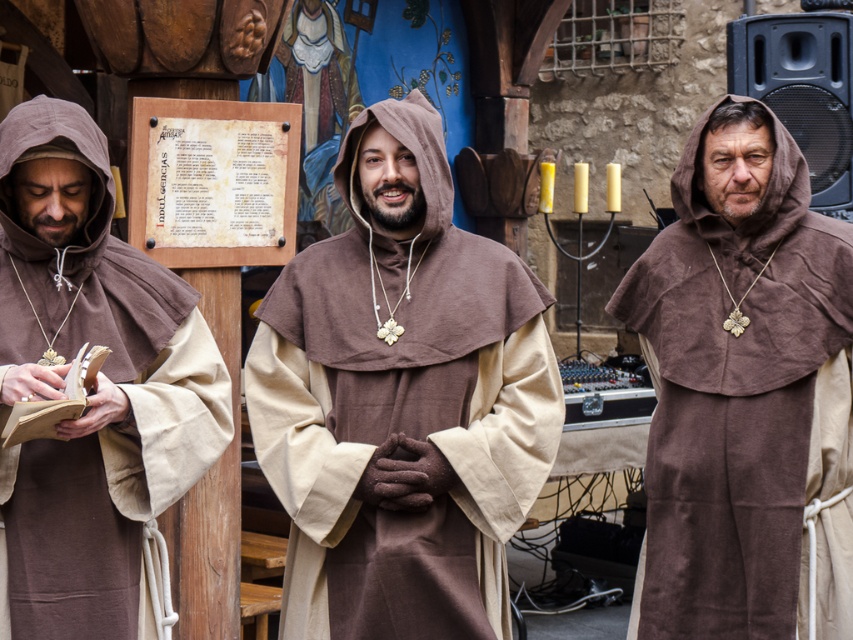
The height and width of the screenshot is (640, 853). Identify the location of brown cotton robe at center. (401, 401).

Is brown cotton robe at center shorter than brown cotton robe at left?

Incorrect, brown cotton robe at center's height does not fall short of brown cotton robe at left's.

I want to click on brown cotton robe at center, so click(x=401, y=401).

Does brown linen robe at right have a smaller size compared to brown cotton robe at left?

Actually, brown linen robe at right might be larger than brown cotton robe at left.

Which is above, brown linen robe at right or brown cotton robe at left?

brown cotton robe at left is above.

Does point (740, 573) come closer to viewer compared to point (24, 108)?

That is False.

The height and width of the screenshot is (640, 853). I want to click on brown linen robe at right, so click(740, 380).

Is brown cotton robe at center smaller than brown linen robe at right?

Yes, brown cotton robe at center is smaller than brown linen robe at right.

Who is taller, brown cotton robe at center or brown linen robe at right?

brown cotton robe at center is taller.

Identify the location of brown cotton robe at center. This screenshot has width=853, height=640. (401, 401).